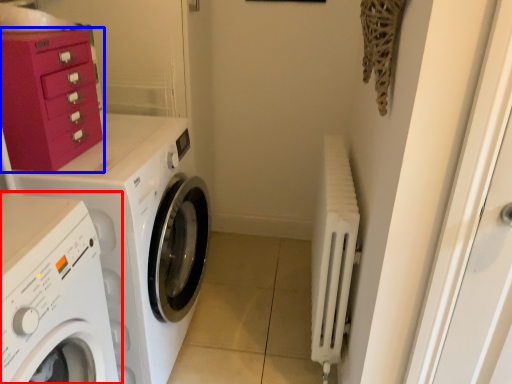
Question: Which point is closer to the camera, washing machine (highlighted by a red box) or cabinetry (highlighted by a blue box)?

Choices:
 (A) washing machine
 (B) cabinetry

Answer: (A)